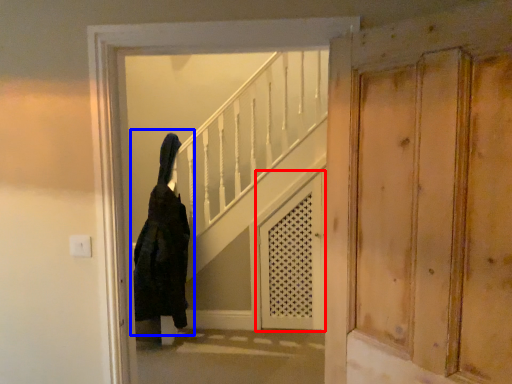
Question: Which point is closer to the camera, screen door (highlighted by a red box) or woman (highlighted by a blue box)?

Choices:
 (A) screen door
 (B) woman

Answer: (B)